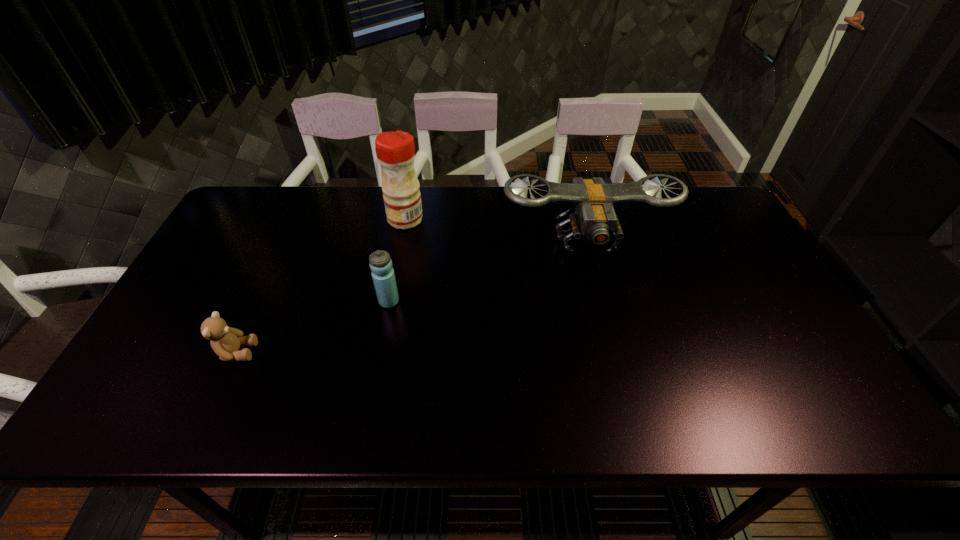
This screenshot has height=540, width=960. What are the coordinates of `condiment` in the screenshot? It's located at (395, 151).

The image size is (960, 540). Identify the location of the rightmost object. (592, 216).

Identify the location of the second nearest object. Image resolution: width=960 pixels, height=540 pixels. (380, 262).

Where is `the shortest object`? The image size is (960, 540). the shortest object is located at coordinates (225, 341).

You are a GUI agent. You are given a task and a screenshot of the screen. Output one action in this format:
    pyautogui.click(x=<x>, y=<y>)
    Task: Click on the nearest object
    The width and height of the screenshot is (960, 540).
    Given the screenshot: What is the action you would take?
    pyautogui.click(x=225, y=341)

Where is `vacant space situated 0.270m on the left of the condiment`? This screenshot has width=960, height=540. vacant space situated 0.270m on the left of the condiment is located at coordinates (302, 219).

The height and width of the screenshot is (540, 960). I want to click on vacant space located on the front-facing side of the rightmost object, so click(604, 312).

Where is `free space located on the back of the third farthest object`? Image resolution: width=960 pixels, height=540 pixels. free space located on the back of the third farthest object is located at coordinates (403, 229).

Find the location of `vacant space situated 0.400m on the front-facing side of the shortest object`. vacant space situated 0.400m on the front-facing side of the shortest object is located at coordinates (423, 352).

At what (x,y) coordinates should I click in order to perform the action: click on condiment present at the far edge. Please return your answer as a coordinate pair (x, y). Looking at the image, I should click on (395, 151).